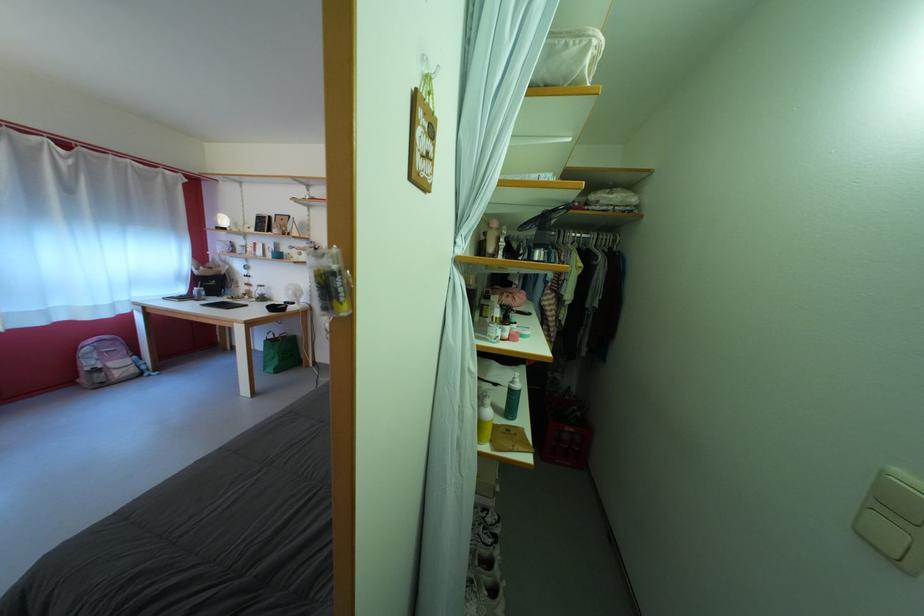
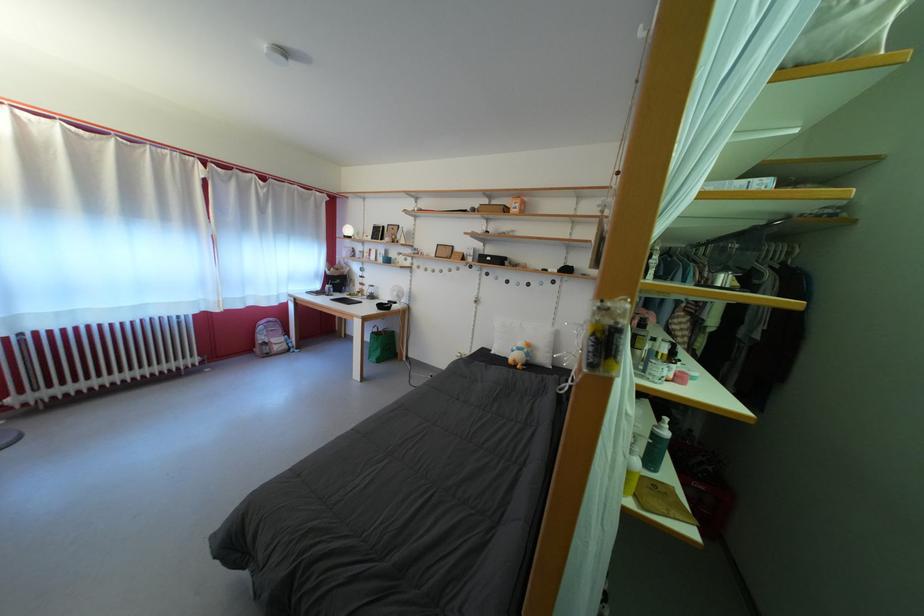
Question: The camera is either moving clockwise (left) or counter-clockwise (right) around the object. The first image is from the beginning of the video and the second image is from the end. Is the camera moving left or right when shooting the video?

Choices:
 (A) Left
 (B) Right

Answer: (B)